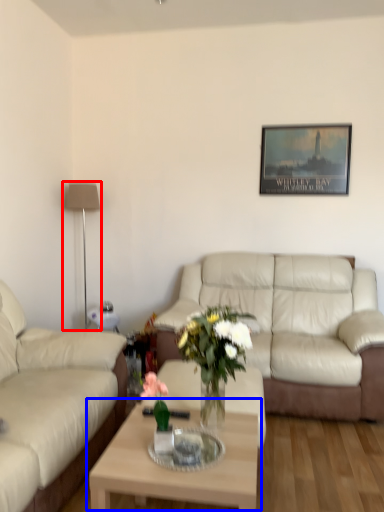
Question: Which object appears closest to the camera in this image, lamp (highlighted by a red box) or coffee table (highlighted by a blue box)?

Choices:
 (A) lamp
 (B) coffee table

Answer: (B)